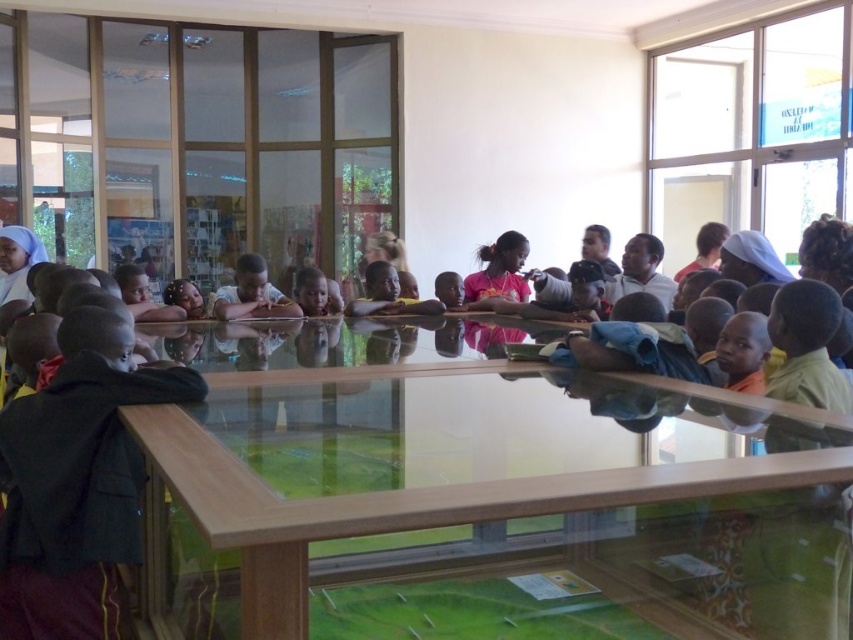
Question: Considering the relative positions of dark brown fabric jacket at left and matte skin child at center in the image provided, where is dark brown fabric jacket at left located with respect to matte skin child at center?

Choices:
 (A) below
 (B) above

Answer: (A)

Question: Which of the following is the closest to the observer?

Choices:
 (A) matte skin child at center
 (B) pink fabric headband at center
 (C) dark brown fabric jacket at left

Answer: (C)

Question: Which of the following is the closest to the observer?

Choices:
 (A) (601, 572)
 (B) (508, 268)
 (C) (318, 282)

Answer: (A)

Question: Can you confirm if transparent glass table at center is positioned below pink fabric headband at center?

Choices:
 (A) no
 (B) yes

Answer: (B)

Question: Based on their relative distances, which object is farther from the dark brown fabric jacket at left?

Choices:
 (A) pink fabric headband at center
 (B) transparent glass table at center

Answer: (A)

Question: Is transparent glass table at center in front of dark brown fabric jacket at left?

Choices:
 (A) no
 (B) yes

Answer: (B)